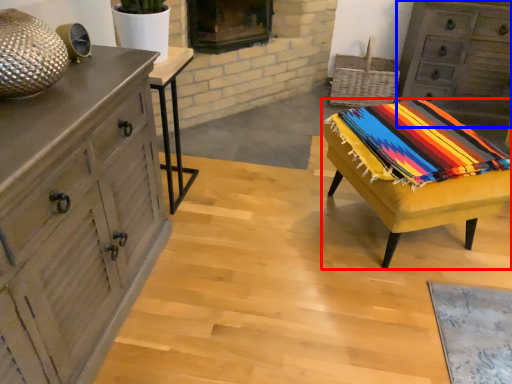
Question: Which of the following is the closest to the observer, table (highlighted by a red box) or chest of drawers (highlighted by a blue box)?

Choices:
 (A) table
 (B) chest of drawers

Answer: (A)